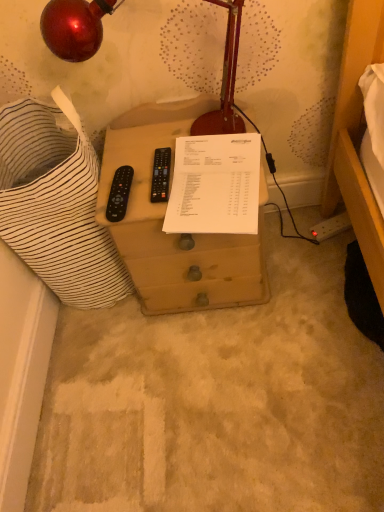
Question: Relative to brown wooden drawer at center, is metallic red lamp at upper left in front or behind?

Choices:
 (A) behind
 (B) front

Answer: (B)

Question: From their relative heights in the image, would you say metallic red lamp at upper left is taller or shorter than brown wooden drawer at center?

Choices:
 (A) tall
 (B) short

Answer: (B)

Question: Which of these objects is positioned farthest from the brown wooden drawer at center?

Choices:
 (A) white paper at center
 (B) metallic red lamp at upper left

Answer: (B)

Question: Considering the real-world distances, which object is farthest from the metallic red lamp at upper left?

Choices:
 (A) brown wooden drawer at center
 (B) white paper at center

Answer: (A)